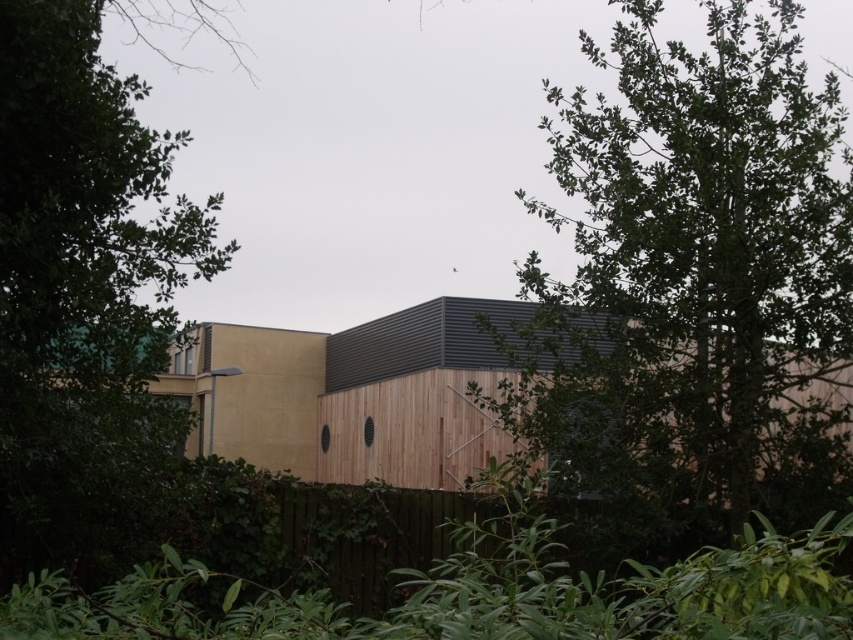
You are standing at the point marked by the coordinates point (695, 280) in the image. Looking around, you see a modern building partially hidden by dense greenery. What is the nearest object to you at this location?

The nearest object to you at point (695, 280) is the green leafy tree at center, as the coordinates correspond directly to its location.

You are a landscape architect designing a garden path that needs to pass between the green leafy tree at center and the green leafy tree at left. Given that the path must be at least 1 meter wide to accommodate a wheelchair, can the path be safely placed between these two trees?

The green leafy tree at center is bigger than the green leafy tree at left, but the description does not provide information about the distance between them. Without knowing the spacing between the two trees, it is impossible to determine if the path will be wide enough for a wheelchair.

Based on the photo, you are standing in a residential area and see the modern building with two circular vents. There are two green leafy trees in front of it. Which tree, the green leafy tree at center or the green leafy tree at left, is closer to you?

The green leafy tree at center is closer to you because it is further to the viewer than the green leafy tree at left.